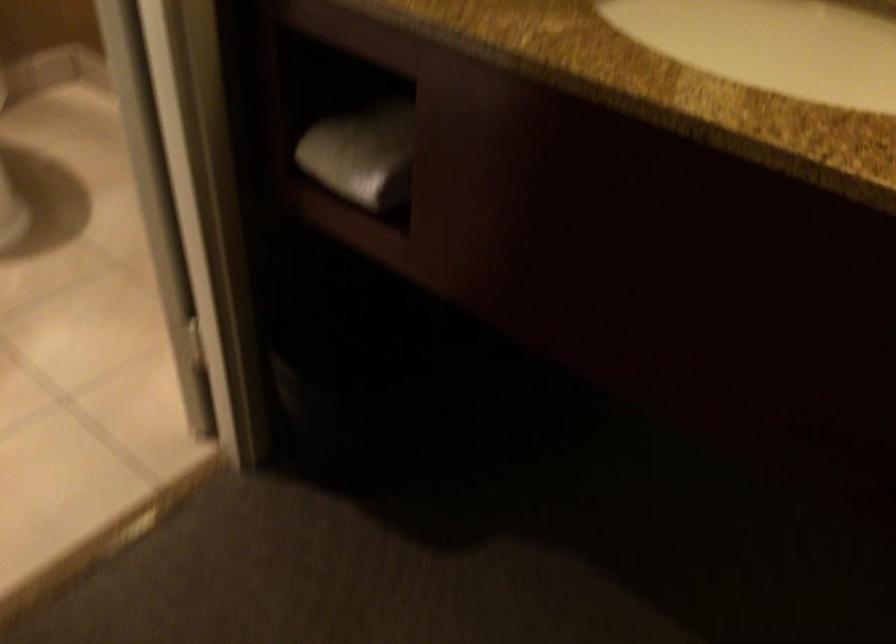
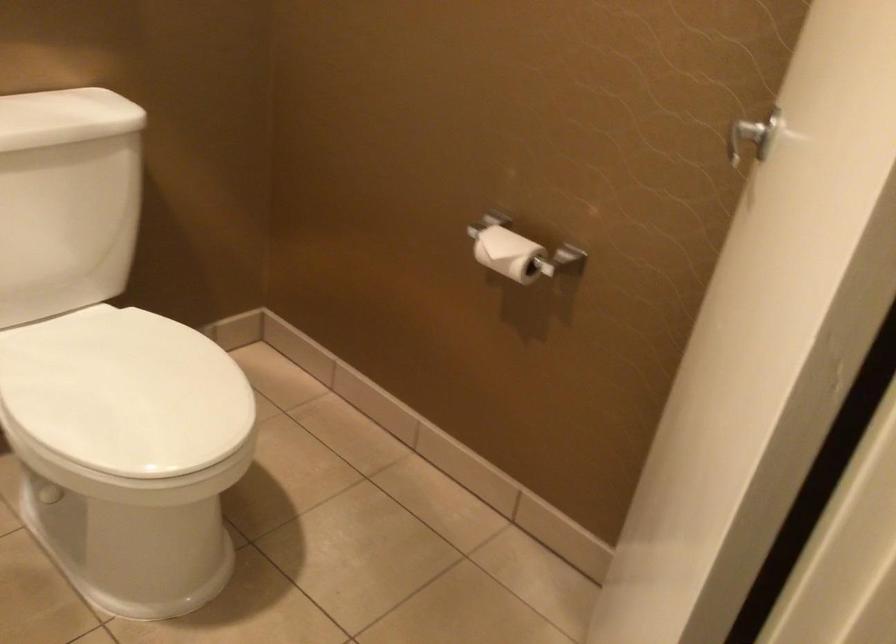
In a continuous first-person perspective shot, in which direction is the camera moving?

The cameraman walked toward left, forward.